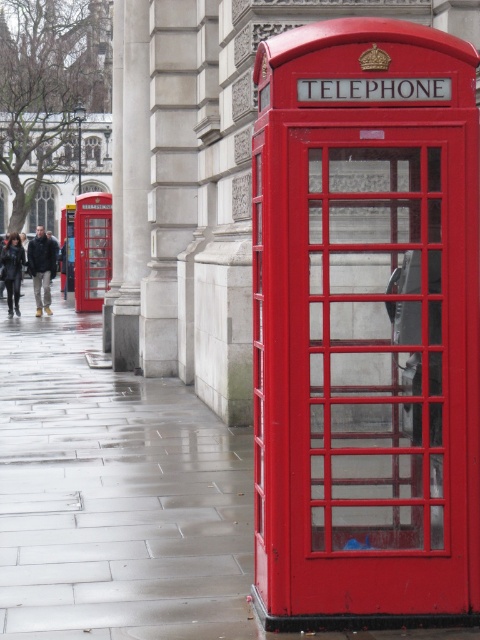
Question: Where is glossy concrete pavement at lower left located in relation to sanded stone column at center in the image?

Choices:
 (A) left
 (B) right

Answer: (A)

Question: Considering the relative positions of matte red telephone at center and sanded stone column at center in the image provided, where is matte red telephone at center located with respect to sanded stone column at center?

Choices:
 (A) above
 (B) below

Answer: (B)

Question: Does smooth stone pillar at upper left have a larger size compared to black leather jacket at left?

Choices:
 (A) no
 (B) yes

Answer: (A)

Question: Which of the following is the closest to the observer?

Choices:
 (A) dark brown leather jacket at left
 (B) smooth stone pillar at upper left
 (C) sanded stone column at center

Answer: (C)

Question: Estimate the real-world distances between objects in this image. Which object is farther from the sanded stone column at center?

Choices:
 (A) glossy concrete pavement at lower left
 (B) dark brown leather jacket at left

Answer: (B)

Question: Which of the following is the closest to the observer?

Choices:
 (A) matte red telephone at center
 (B) black leather jacket at left
 (C) glossy concrete pavement at lower left
 (D) sanded stone column at center

Answer: (A)